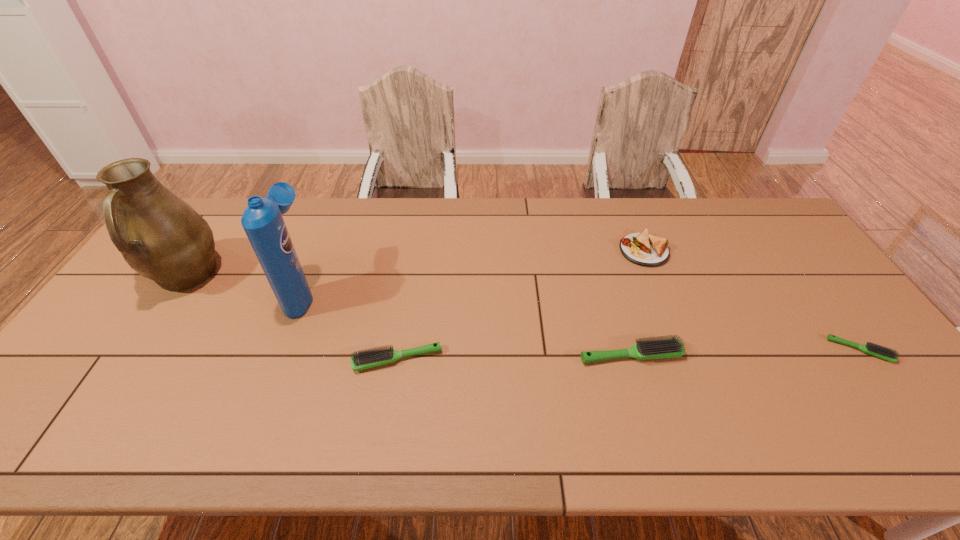
Considering the uniform spacing of hairbrushs, where should an additional hairbrush be positioned on the left? Please locate a free spot. Please provide its 2D coordinates. Your answer should be formatted as a tuple, i.e. [(x, y)], where the tuple contains the x and y coordinates of a point satisfying the conditions above.

[(159, 364)]